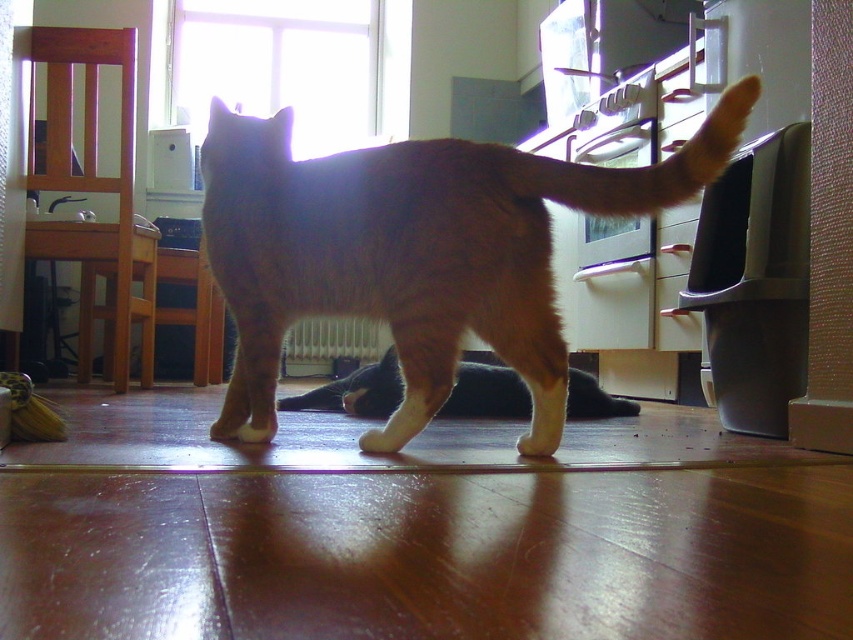
Question: Is orange fur tabby cat at center above orange fur cat at center?

Choices:
 (A) no
 (B) yes

Answer: (B)

Question: In this image, where is orange fur cat at center located relative to white fur paw at lower center?

Choices:
 (A) above
 (B) below

Answer: (A)

Question: Which is farther from the orange fur tail at upper right?

Choices:
 (A) orange fur cat at center
 (B) white matte paw at center
 (C) white fur paw at lower center
 (D) orange fur tabby cat at center

Answer: (A)

Question: Which point is farther from the camera taking this photo?

Choices:
 (A) (312, 163)
 (B) (370, 433)
 (C) (468, 394)
 (D) (683, 170)

Answer: (C)

Question: Which point is closer to the camera taking this photo?

Choices:
 (A) [572, 403]
 (B) [521, 454]
 (C) [383, 449]

Answer: (C)

Question: Is the position of orange fur cat at center less distant than that of white matte paw at center?

Choices:
 (A) yes
 (B) no

Answer: (B)